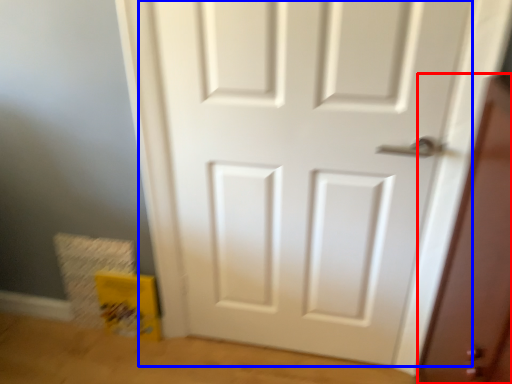
Question: Which object appears closest to the camera in this image, screen door (highlighted by a red box) or door (highlighted by a blue box)?

Choices:
 (A) screen door
 (B) door

Answer: (A)